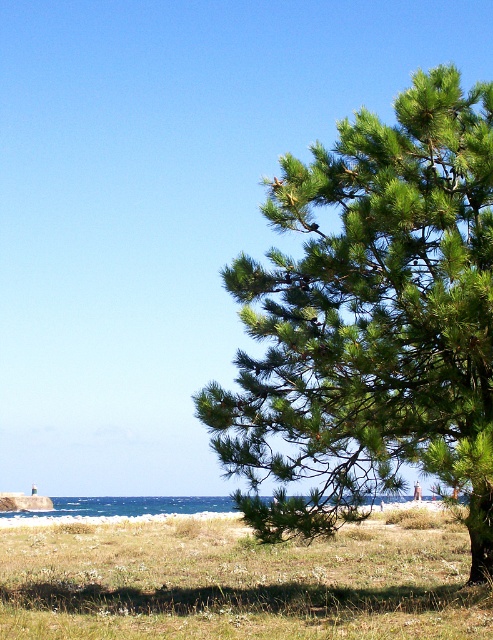
Can you confirm if green needle-like at right is shorter than green grassy at lower center?

Incorrect, green needle-like at right's height does not fall short of green grassy at lower center's.

Consider the image. Who is more forward, (393, 467) or (235, 589)?

Positioned in front is point (393, 467).

Who is more distant from viewer, (470, 497) or (147, 522)?

The point (147, 522) is behind.

Where is `green needle-like at right`? green needle-like at right is located at coordinates (372, 321).